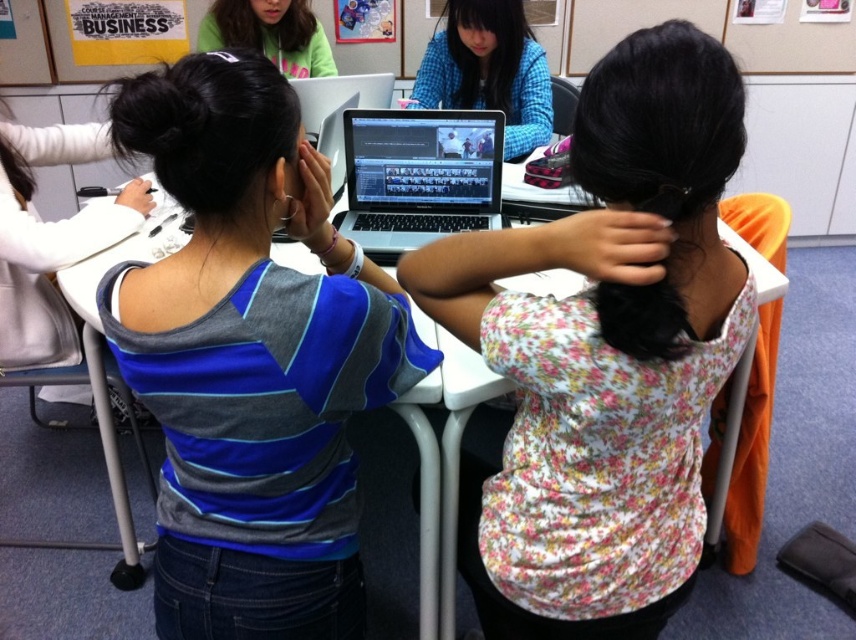
Question: Which point is closer to the camera taking this photo?

Choices:
 (A) (492, 328)
 (B) (238, 17)

Answer: (A)

Question: Does blue striped shirt at center appear on the right side of blue plaid shirt at center?

Choices:
 (A) no
 (B) yes

Answer: (A)

Question: Does floral fabric blouse at center have a larger size compared to satin black laptop at center?

Choices:
 (A) no
 (B) yes

Answer: (B)

Question: Observing the image, what is the correct spatial positioning of silver metallic laptop at center in reference to white plastic table at center?

Choices:
 (A) right
 (B) left

Answer: (A)

Question: Among these objects, which one is farthest from the camera?

Choices:
 (A) blue plaid shirt at center
 (B) floral fabric blouse at center
 (C) satin black laptop at center
 (D) matte green hoodie at upper left

Answer: (D)

Question: Which object is closer to the camera taking this photo?

Choices:
 (A) matte green hoodie at upper left
 (B) blue striped shirt at center

Answer: (B)